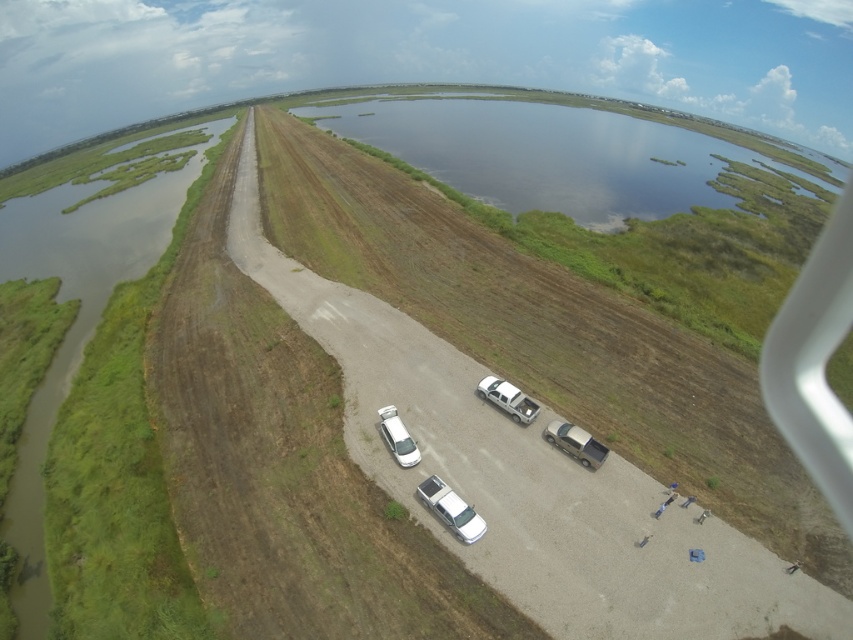
Question: Is silver metallic truck at lower right above white glossy car at center?

Choices:
 (A) no
 (B) yes

Answer: (A)

Question: Which object appears closest to the camera in this image?

Choices:
 (A) white matte truck at center
 (B) green grassy waterway at left

Answer: (B)

Question: Estimate the real-world distances between objects in this image. Which object is closer to the white glossy car at center?

Choices:
 (A) white matte truck at center
 (B) green grassy waterway at left
 (C) white glossy truck at center
 (D) silver metallic truck at lower right

Answer: (C)

Question: In this image, where is green grassy waterway at left located relative to white matte truck at center?

Choices:
 (A) left
 (B) right

Answer: (A)

Question: Which of the following is the farthest from the observer?

Choices:
 (A) (442, 481)
 (B) (506, 406)

Answer: (B)

Question: Is white glossy truck at center above white matte truck at center?

Choices:
 (A) no
 (B) yes

Answer: (A)